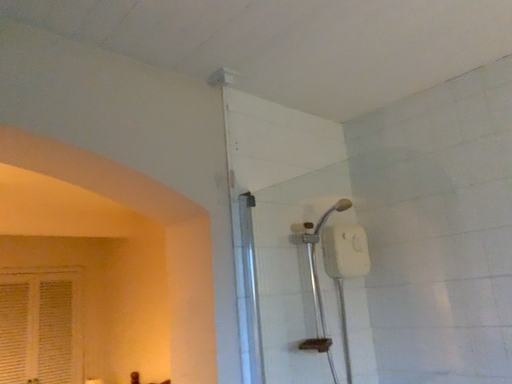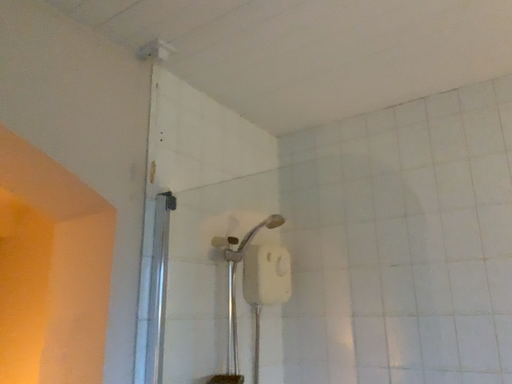
Question: Which way did the camera rotate in the video?

Choices:
 (A) rotated right
 (B) rotated left

Answer: (A)